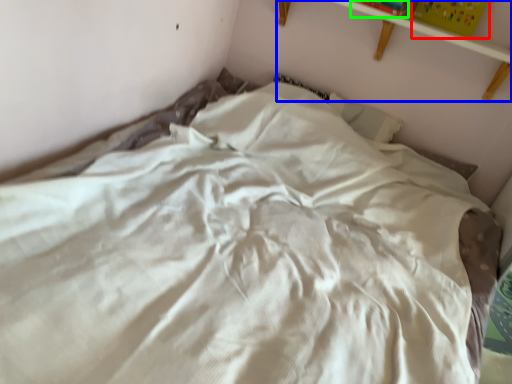
Question: Estimate the real-world distances between objects in this image. Which object is farther from paperback book (highlighted by a red box), shelf (highlighted by a blue box) or paperback book (highlighted by a green box)?

Choices:
 (A) shelf
 (B) paperback book

Answer: (B)